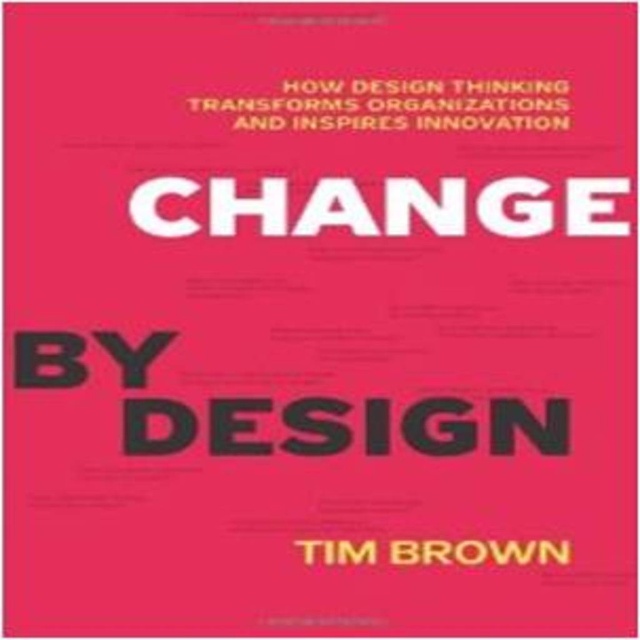
Question: Which object is closer to the camera taking this photo?

Choices:
 (A) white matte text at center
 (B) whitetexttim brown at center

Answer: (B)

Question: Does white matte text at center have a smaller size compared to whitetexttim brown at center?

Choices:
 (A) no
 (B) yes

Answer: (A)

Question: Which object appears farthest from the camera in this image?

Choices:
 (A) yellow text at upper center
 (B) white matte text at center
 (C) whitetexttim brown at center

Answer: (B)

Question: Which of the following is the farthest from the observer?

Choices:
 (A) whitetexttim brown at center
 (B) white matte text at center
 (C) yellow text at upper center

Answer: (B)

Question: Does white matte text at center appear on the left side of yellow text at upper center?

Choices:
 (A) yes
 (B) no

Answer: (A)

Question: Observing the image, what is the correct spatial positioning of white matte text at center in reference to whitetexttim brown at center?

Choices:
 (A) below
 (B) above

Answer: (B)